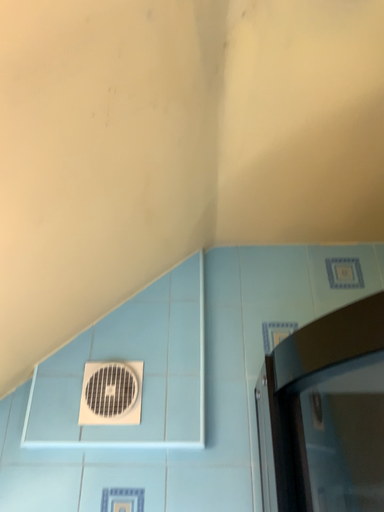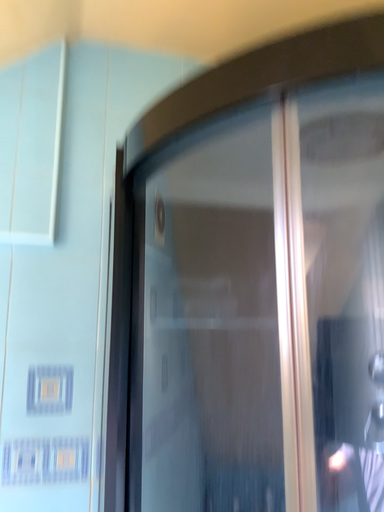
Question: Which way did the camera rotate in the video?

Choices:
 (A) rotated left
 (B) rotated right

Answer: (B)